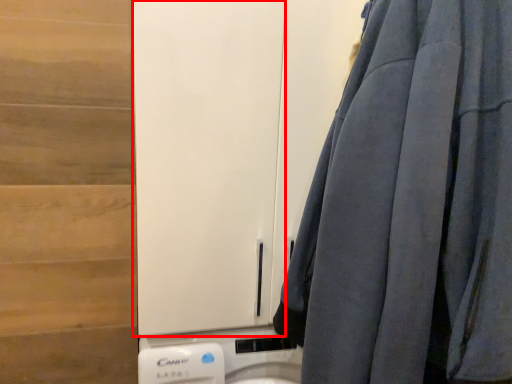
Question: From the image's perspective, where is barn door (annotated by the red box) located in relation to curtain in the image?

Choices:
 (A) below
 (B) above

Answer: (B)